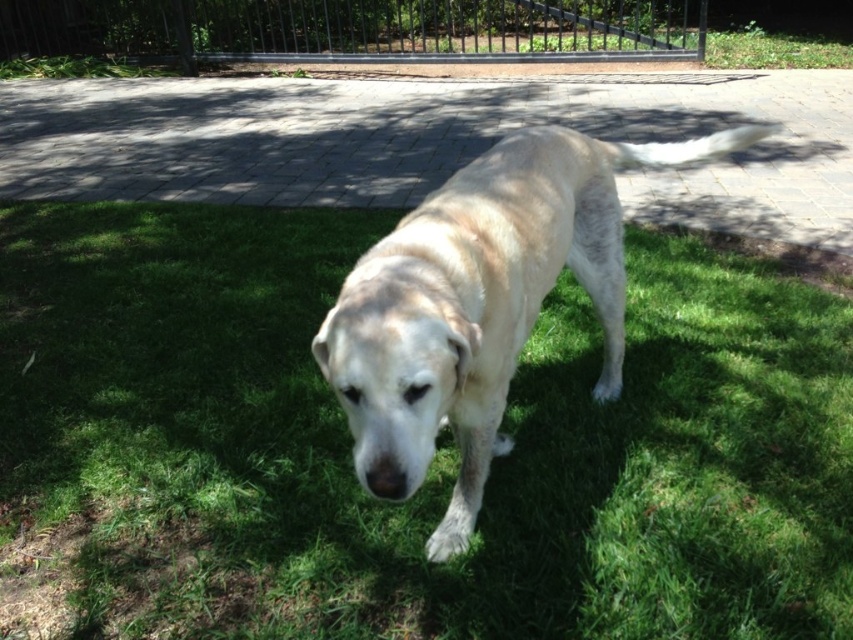
Is light beige fur dog at center bigger than black metal fence at upper center?

No, light beige fur dog at center is not bigger than black metal fence at upper center.

Is light beige fur dog at center above black metal fence at upper center?

Actually, light beige fur dog at center is below black metal fence at upper center.

Which is in front, point (534, 147) or point (335, 20)?

Point (534, 147) is more forward.

The width and height of the screenshot is (853, 640). Find the location of `light beige fur dog at center`. light beige fur dog at center is located at coordinates (480, 304).

Who is more forward, (668, 300) or (682, 13)?

Point (668, 300)

Is green grass at center to the right of black metal fence at upper center from the viewer's perspective?

Correct, you'll find green grass at center to the right of black metal fence at upper center.

Is point (119, 566) closer to camera compared to point (97, 29)?

Yes, point (119, 566) is in front of point (97, 29).

This screenshot has height=640, width=853. I want to click on green grass at center, so click(x=434, y=456).

How far apart are green grass at center and light beige fur dog at center?

green grass at center is 36.14 inches away from light beige fur dog at center.

Does green grass at center appear under light beige fur dog at center?

Yes, green grass at center is below light beige fur dog at center.

Identify the location of green grass at center. (434, 456).

Where is `green grass at center`? green grass at center is located at coordinates (434, 456).